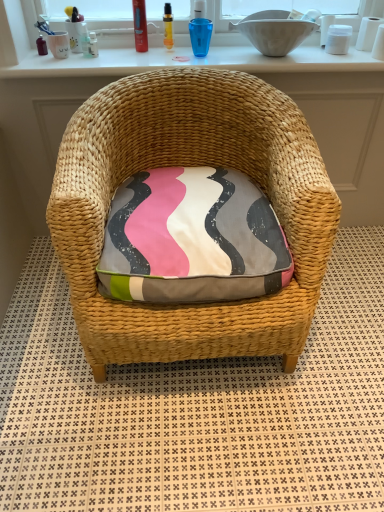
Question: Considering their positions, is natural woven chair at center located in front of or behind white ceramic bowl at upper center?

Choices:
 (A) behind
 (B) front

Answer: (A)

Question: From the image's perspective, is natural woven chair at center above or below white ceramic bowl at upper center?

Choices:
 (A) above
 (B) below

Answer: (B)

Question: Considering the real-world distances, which object is farthest from the textured cotton cushion at center?

Choices:
 (A) white ceramic bowl at upper center
 (B) natural woven chair at center
 (C) translucent plastic toothbrush at upper center, the 1th toiletry from the left
 (D) shiny red can at upper center, marked as the second toiletry in a left-to-right arrangement
 (E) translucent plastic vial at upper center, which is the 3th toiletry from left to right

Answer: (C)

Question: Which object is the closest to the translucent plastic toothbrush at upper center, the 1th toiletry from the left?

Choices:
 (A) shiny red can at upper center, marked as the second toiletry in a left-to-right arrangement
 (B) white ceramic bowl at upper center
 (C) white glossy window sill at upper center
 (D) natural woven chair at center
 (E) textured cotton cushion at center

Answer: (A)